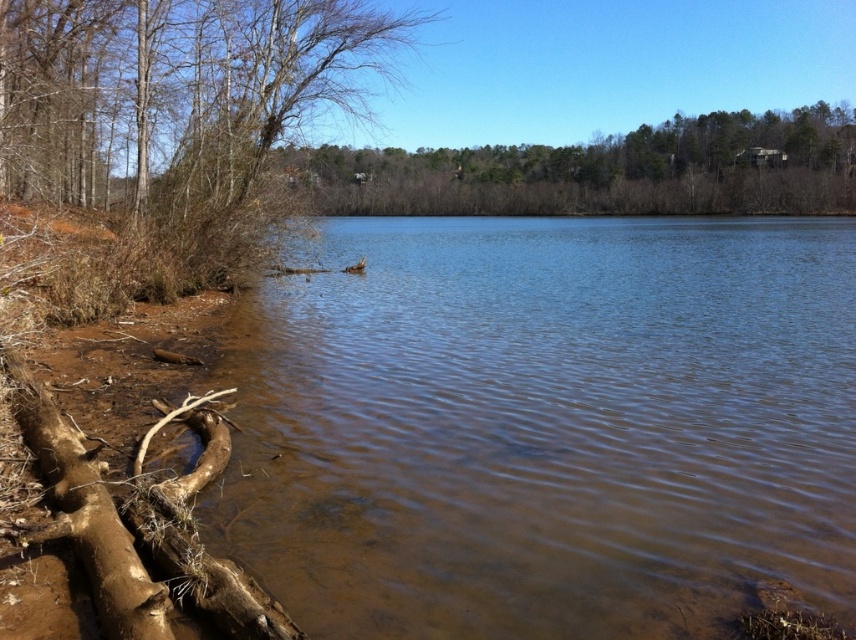
Between brown bark tree at left and brown rough wood at lower left, which one has more height?

With more height is brown bark tree at left.

Is point (177, 70) positioned behind point (170, 605)?

Yes, it is behind point (170, 605).

The image size is (856, 640). I want to click on brown bark tree at left, so click(177, 106).

Does brown sediment water at lower left appear under brown rough wood at lower left?

No, brown sediment water at lower left is not below brown rough wood at lower left.

The width and height of the screenshot is (856, 640). I want to click on brown sediment water at lower left, so click(548, 426).

At what (x,y) coordinates should I click in order to perform the action: click on brown sediment water at lower left. Please return your answer as a coordinate pair (x, y). The height and width of the screenshot is (640, 856). Looking at the image, I should click on (548, 426).

Does brown sediment water at lower left appear over brown bark tree at left?

Incorrect, brown sediment water at lower left is not positioned above brown bark tree at left.

Identify the location of brown sediment water at lower left. (548, 426).